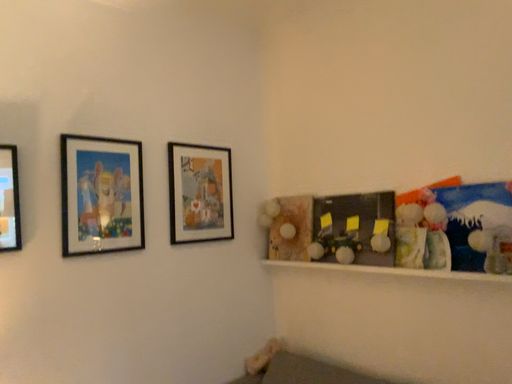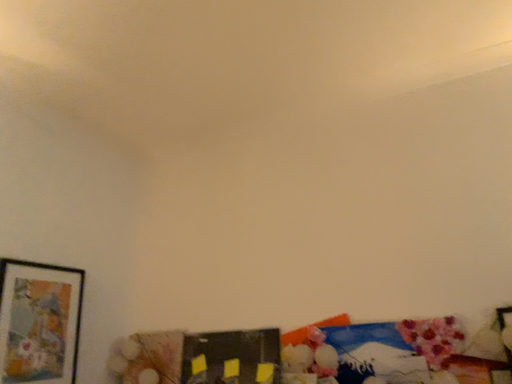
Question: Which way did the camera rotate in the video?

Choices:
 (A) rotated downward
 (B) rotated upward

Answer: (B)